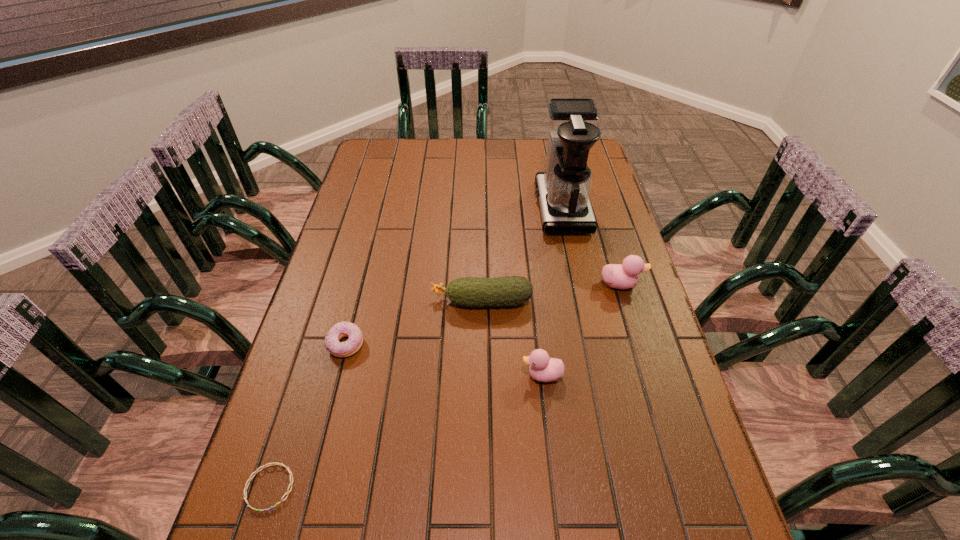
Locate an element on the screen. The image size is (960, 540). vacant space in between the cucumber and the right duckling is located at coordinates (551, 292).

What are the coordinates of `vacant point located between the bracelet and the fourth farthest object` in the screenshot? It's located at pos(308,416).

Identify the location of object that ranks as the second closest to the cucumber. (342, 329).

Locate which object is the closest to the taller duckling. Please provide its 2D coordinates. Your answer should be formatted as a tuple, i.e. [(x, y)], where the tuple contains the x and y coordinates of a point satisfying the conditions above.

[(563, 190)]

The width and height of the screenshot is (960, 540). In order to click on free space that satisfies the following two spatial constraints: 1. at the blossom end of the cucumber; 2. on the surface of the nearest object showing star-shaped elements in this screenshot , I will do `click(483, 487)`.

Where is `free space that satisfies the following two spatial constraints: 1. on the front-facing side of the shorter duckling; 2. on the surface of the bracelet showing star-shaped elements`? The width and height of the screenshot is (960, 540). free space that satisfies the following two spatial constraints: 1. on the front-facing side of the shorter duckling; 2. on the surface of the bracelet showing star-shaped elements is located at coordinates (555, 487).

Identify the location of free spot that satisfies the following two spatial constraints: 1. at the blossom end of the cucumber; 2. on the surface of the bracelet showing star-shaped elements. (483, 487).

Find the location of a particular element. The width and height of the screenshot is (960, 540). vacant region that satisfies the following two spatial constraints: 1. on the front-facing side of the right duckling; 2. on the front side of the doughnut is located at coordinates (639, 345).

Find the location of a particular element. This screenshot has width=960, height=540. free region that satisfies the following two spatial constraints: 1. at the blossom end of the cucumber; 2. on the surface of the shortest object showing star-shaped elements is located at coordinates (483, 487).